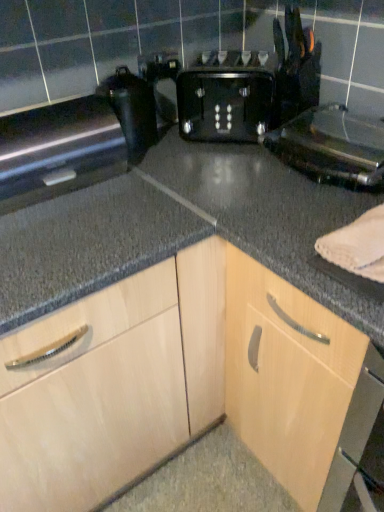
You are a GUI agent. You are given a task and a screenshot of the screen. Output one action in this format:
    pyautogui.click(x=<x>, y=<y>)
    Task: Click on the vacant region to the left of black plastic toaster at center
    Image resolution: width=384 pixels, height=512 pixels.
    Given the screenshot: What is the action you would take?
    pyautogui.click(x=165, y=149)